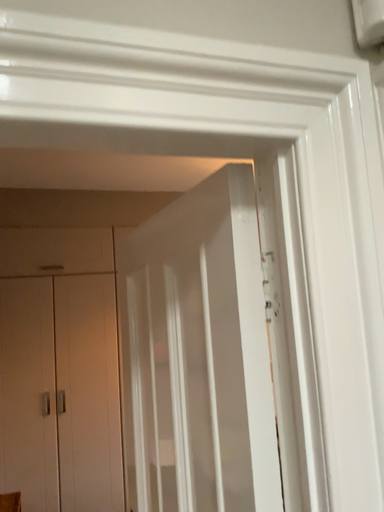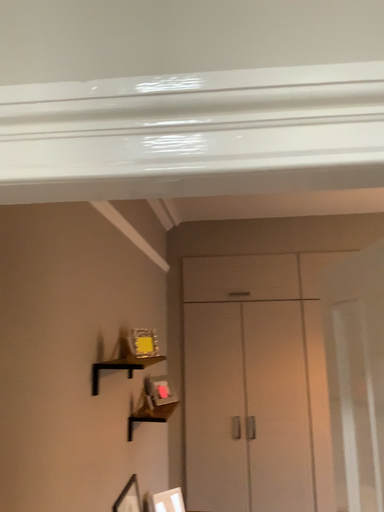
Question: How did the camera likely rotate when shooting the video?

Choices:
 (A) rotated right
 (B) rotated left

Answer: (B)